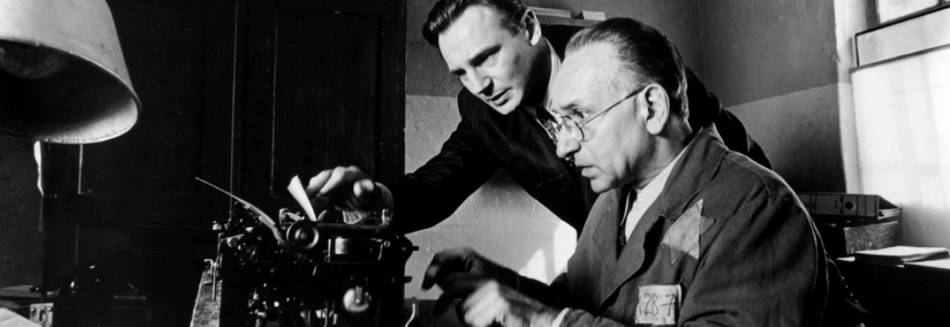
Identify the location of lampshade. Image resolution: width=950 pixels, height=327 pixels. (65, 38).